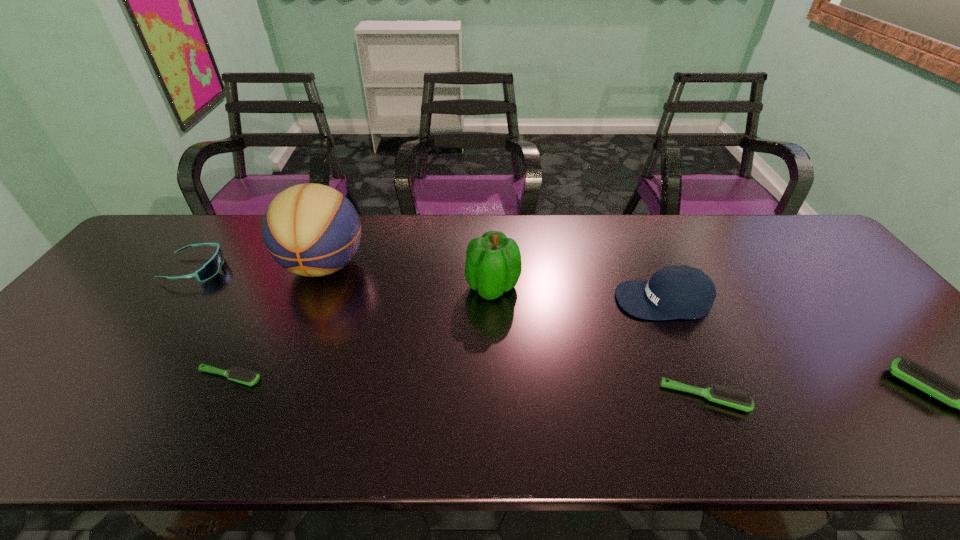
Identify the location of object positioned at the far left corner. 211,268.

You are a GUI agent. You are given a task and a screenshot of the screen. Output one action in this format:
    pyautogui.click(x=<x>, y=<y>)
    Task: Click on the free space at the far edge of the desktop
    This screenshot has width=960, height=540.
    Given the screenshot: What is the action you would take?
    pyautogui.click(x=246, y=232)

This screenshot has height=540, width=960. What are the coordinates of `vacant space at the near edge of the desktop` in the screenshot? It's located at (701, 385).

The height and width of the screenshot is (540, 960). Identify the location of free spot at the left edge of the desktop. (49, 352).

In the image, there is a desktop. Where is `vacant space at the far right corner`? This screenshot has width=960, height=540. vacant space at the far right corner is located at coordinates (794, 238).

The width and height of the screenshot is (960, 540). I want to click on empty space that is in between the tallest object and the sunglasses, so click(260, 267).

In order to click on free space between the fifth shortest object and the second shortest hairbrush in this screenshot , I will do `click(684, 349)`.

Where is `free space between the fifth shortest object and the leftmost object`? Image resolution: width=960 pixels, height=540 pixels. free space between the fifth shortest object and the leftmost object is located at coordinates (429, 285).

Find the location of `free space between the sixth tallest object and the bell pepper`. free space between the sixth tallest object and the bell pepper is located at coordinates (598, 342).

Where is `empty space that is in between the shortest hairbrush and the sunglasses`? Image resolution: width=960 pixels, height=540 pixels. empty space that is in between the shortest hairbrush and the sunglasses is located at coordinates (213, 323).